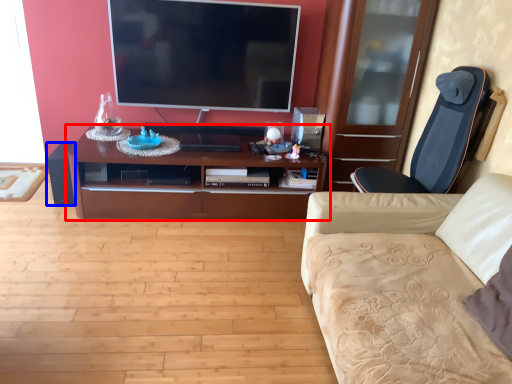
Question: Among these objects, which one is farthest to the camera, cabinetry (highlighted by a red box) or speaker (highlighted by a blue box)?

Choices:
 (A) cabinetry
 (B) speaker

Answer: (B)